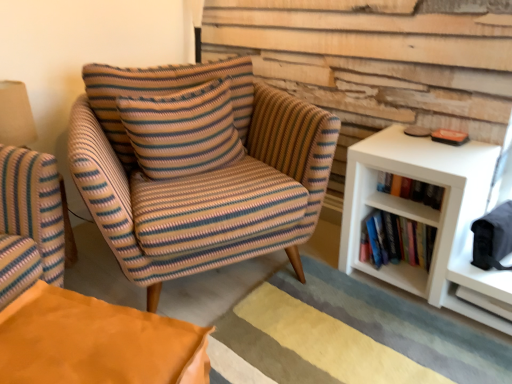
Question: From the image's perspective, is hardcover books at right above or below striped fabric armchair at center?

Choices:
 (A) above
 (B) below

Answer: (B)

Question: Considering the positions of hardcover books at right and striped fabric armchair at center in the image, is hardcover books at right taller or shorter than striped fabric armchair at center?

Choices:
 (A) short
 (B) tall

Answer: (A)

Question: Considering the real-world distances, which object is farthest from the striped fabric armchair at center?

Choices:
 (A) knitted fabric pillow at center
 (B) white matte shelf at right, which ranks as the second shelf in left-to-right order
 (C) hardcover books at right
 (D) white matte bookshelf at right, arranged as the 1th shelf when viewed from the left

Answer: (B)

Question: Considering the real-world distances, which object is farthest from the striped fabric armchair at center?

Choices:
 (A) hardcover books at right
 (B) knitted fabric pillow at center
 (C) white matte shelf at right, which ranks as the second shelf in left-to-right order
 (D) white matte bookshelf at right, arranged as the 1th shelf when viewed from the left

Answer: (C)